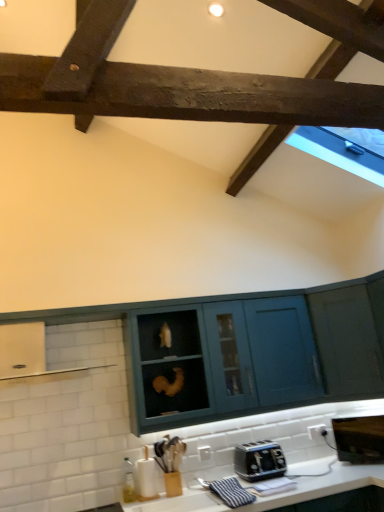
Question: Does black metallic toaster at lower center touch white glossy countertop at lower center?

Choices:
 (A) yes
 (B) no

Answer: (B)

Question: Does black metallic toaster at lower center lie in front of white glossy countertop at lower center?

Choices:
 (A) yes
 (B) no

Answer: (B)

Question: Is black metallic toaster at lower center facing away from white glossy countertop at lower center?

Choices:
 (A) no
 (B) yes

Answer: (A)

Question: From the image's perspective, is black metallic toaster at lower center located above white glossy countertop at lower center?

Choices:
 (A) no
 (B) yes

Answer: (B)

Question: From the image's perspective, is black metallic toaster at lower center under white glossy countertop at lower center?

Choices:
 (A) no
 (B) yes

Answer: (A)

Question: Is black metallic toaster at lower center aimed at white glossy countertop at lower center?

Choices:
 (A) yes
 (B) no

Answer: (B)

Question: Considering the relative positions of teal matte cabinet at center, which is the second cabinetry from left to right, and teal matte cabinet at right, arranged as the 1th cabinetry when viewed from the right, in the image provided, is teal matte cabinet at center, which is the second cabinetry from left to right, to the right of teal matte cabinet at right, arranged as the 1th cabinetry when viewed from the right, from the viewer's perspective?

Choices:
 (A) no
 (B) yes

Answer: (A)

Question: Is teal matte cabinet at center, which is the second cabinetry from left to right, not near teal matte cabinet at right, the third cabinetry in the left-to-right sequence?

Choices:
 (A) yes
 (B) no

Answer: (B)

Question: Is teal matte cabinet at right, arranged as the 1th cabinetry when viewed from the right, located within teal matte cabinet at center, which is the second cabinetry from left to right?

Choices:
 (A) yes
 (B) no

Answer: (B)

Question: Does teal matte cabinet at center, which appears as the second cabinetry when viewed from the right, have a lesser width compared to teal matte cabinet at right, arranged as the 1th cabinetry when viewed from the right?

Choices:
 (A) yes
 (B) no

Answer: (A)

Question: Is teal matte cabinet at center, which is the second cabinetry from left to right, in contact with teal matte cabinet at right, the third cabinetry in the left-to-right sequence?

Choices:
 (A) no
 (B) yes

Answer: (A)

Question: Does teal matte cabinet at center, which appears as the second cabinetry when viewed from the right, have a lesser height compared to teal matte cabinet at right, arranged as the 1th cabinetry when viewed from the right?

Choices:
 (A) yes
 (B) no

Answer: (A)

Question: Can you confirm if teal matte cabinet at center, which appears as the second cabinetry when viewed from the right, is wider than white glossy exhaust hood at left?

Choices:
 (A) no
 (B) yes

Answer: (A)